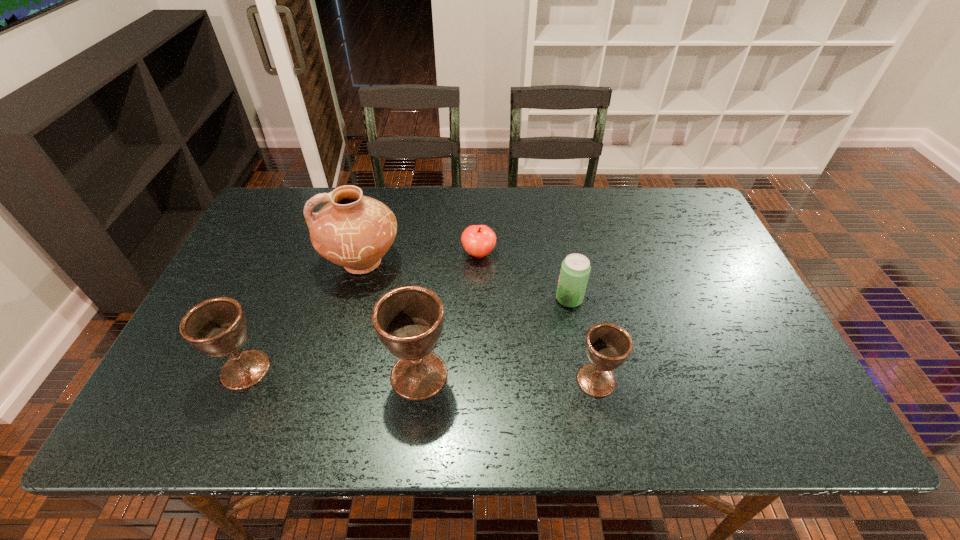
You are a GUI agent. You are given a task and a screenshot of the screen. Output one action in this format:
    pyautogui.click(x=<x>, y=<y>)
    Task: Click on the empty location between the rightmost chalice and the soda
    
    Given the screenshot: What is the action you would take?
    pyautogui.click(x=583, y=340)

Where is `free spot between the apple and the second object from left to right`? Image resolution: width=960 pixels, height=540 pixels. free spot between the apple and the second object from left to right is located at coordinates (420, 258).

I want to click on free spot between the tallest chalice and the leftmost chalice, so click(x=332, y=372).

Choose which object is the nearest neighbor to the leftmost chalice. Please provide its 2D coordinates. Your answer should be formatted as a tuple, i.e. [(x, y)], where the tuple contains the x and y coordinates of a point satisfying the conditions above.

[(354, 231)]

Select which object is the third closest to the second object from left to right. Please provide its 2D coordinates. Your answer should be formatted as a tuple, i.e. [(x, y)], where the tuple contains the x and y coordinates of a point satisfying the conditions above.

[(409, 320)]

Identify which chalice is located as the second nearest to the shortest chalice. Please provide its 2D coordinates. Your answer should be formatted as a tuple, i.e. [(x, y)], where the tuple contains the x and y coordinates of a point satisfying the conditions above.

[(217, 327)]

Find the location of a particular element. This screenshot has height=540, width=960. chalice that is the closest one to the pottery is located at coordinates (217, 327).

The image size is (960, 540). Find the location of `vacant space that satisfies the following two spatial constraints: 1. on the front side of the soda; 2. on the left side of the apple`. vacant space that satisfies the following two spatial constraints: 1. on the front side of the soda; 2. on the left side of the apple is located at coordinates (479, 299).

The height and width of the screenshot is (540, 960). Identify the location of blank area in the image that satisfies the following two spatial constraints: 1. on the back side of the fourth object from left to right; 2. on the left side of the second chalice from right to left. (432, 254).